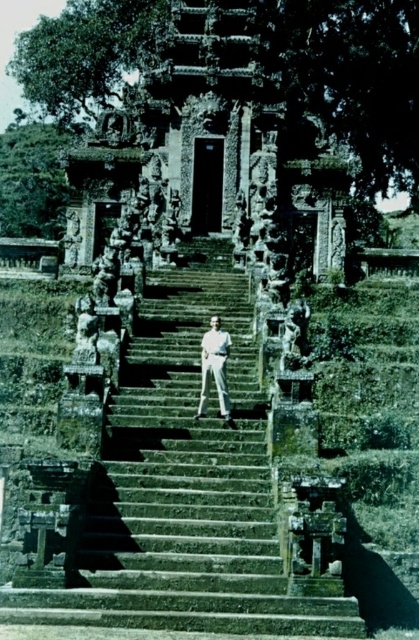
Is green stone stairs at center taller than white cotton pants at center?

Yes, green stone stairs at center is taller than white cotton pants at center.

In the scene shown: Can you confirm if green stone stairs at center is positioned above white cotton pants at center?

Incorrect, green stone stairs at center is not positioned above white cotton pants at center.

Image resolution: width=419 pixels, height=640 pixels. What are the coordinates of `green stone stairs at center` in the screenshot? It's located at (185, 486).